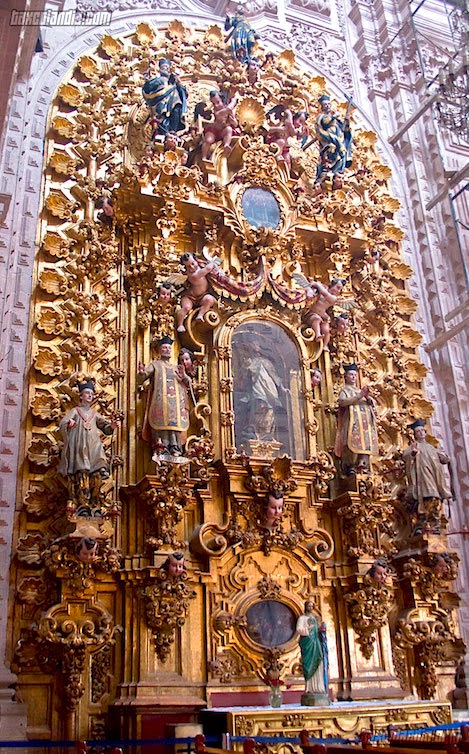
Identify the location of painting. This screenshot has width=469, height=754. (267, 204), (261, 379).